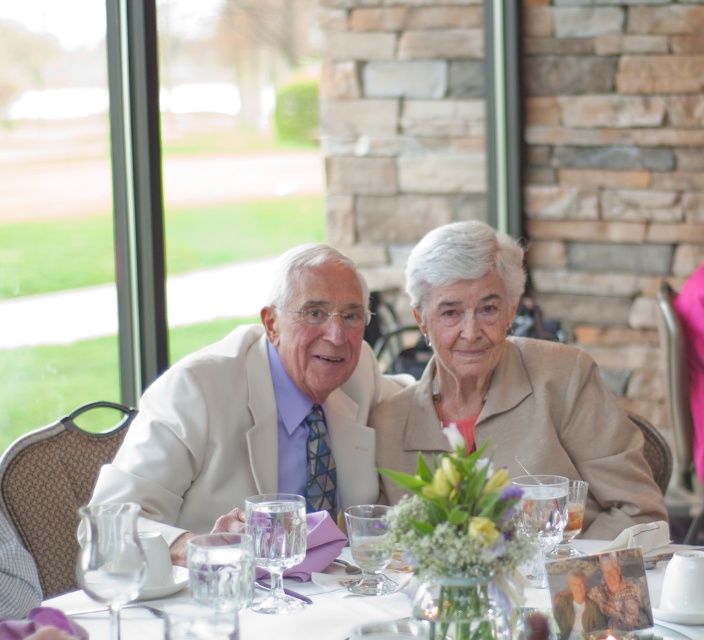
You are a photographer setting up for a portrait. You notice the beige fabric jacket at center and the white porcelain plate at lower center. Which object should you focus on if you want to capture the larger item in your shot?

The beige fabric jacket at center is bigger than the white porcelain plate at lower center, so you should focus on the beige fabric jacket at center to capture the larger item.

You are a photographer standing at point (320, 340). You want to take a photo of both the man on the left and the woman on the right. Can you fit both of them in your camera frame if your camera has a 10 feet wide field of view?

The man on the left and the woman on the right are 9.14 feet apart, so yes, the photographer can fit both of them in the camera frame since the distance between them is less than the 10 feet field of view.

You are a photographer adjusting your camera settings and notice the white fabric suit at center and the white porcelain plate at lower center in your viewfinder. Which object will appear larger in the photo?

The white fabric suit at center will appear larger in the photo because it is closer to the viewer than the white porcelain plate at lower center.